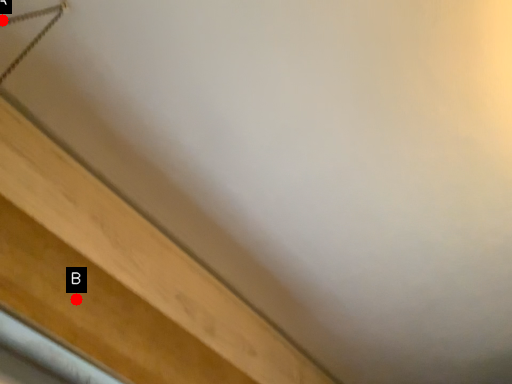
Question: Two points are circled on the image, labeled by A and B beside each circle. Which point is closer to the camera?

Choices:
 (A) A is closer
 (B) B is closer

Answer: (B)